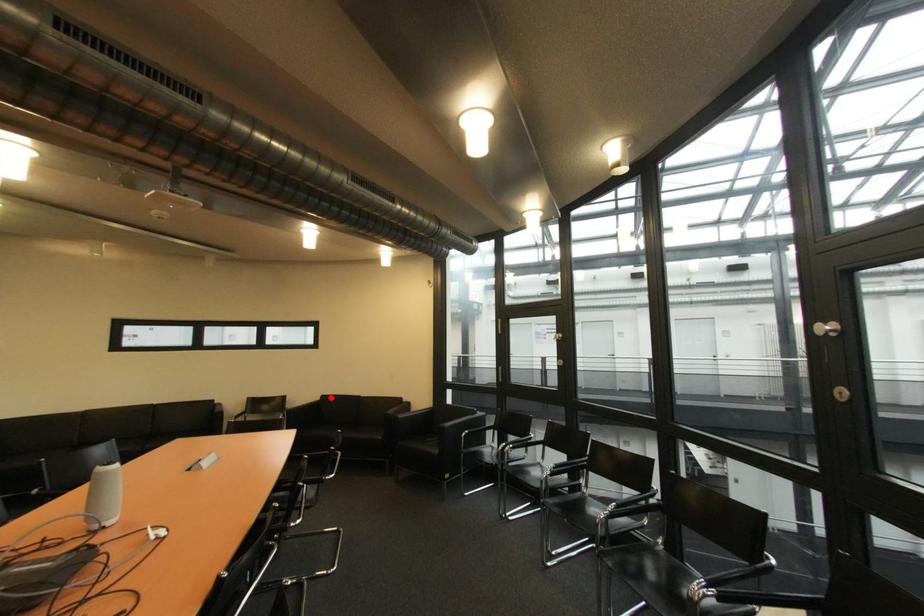
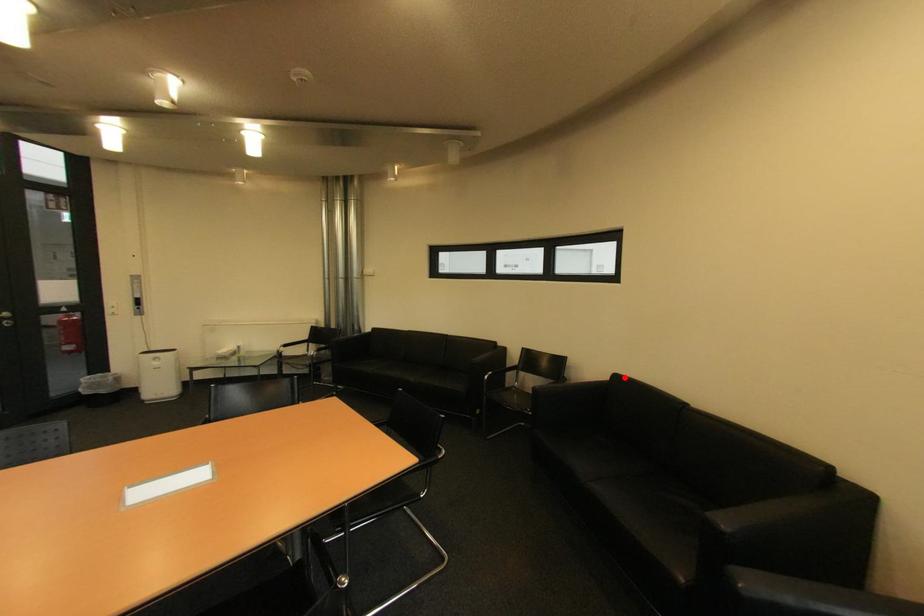
I am providing you with two images of the same scene from different viewpoints. A red point is marked on the first image and another point is marked on the second image. Does the point marked in image1 correspond to the same location as the one in image2?

Yes